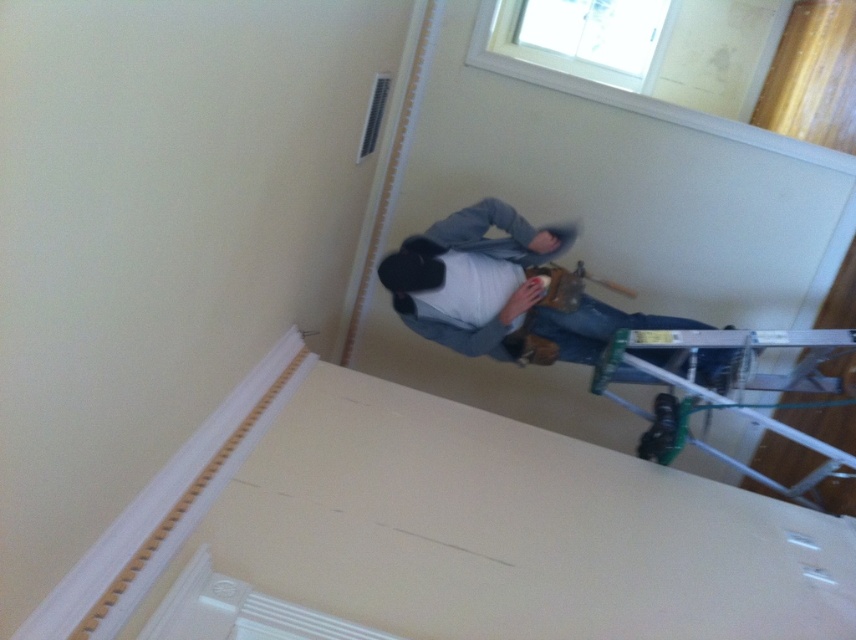
You are a contractor assessing the workspace. You need to move the metallic silver ladder at lower right closer to the window. However, the denim jacket at upper right is in the way. Can you move the ladder around the jacket without moving the jacket itself?

The metallic silver ladder at lower right is behind the denim jacket at upper right. Since the ladder is already positioned behind the jacket, you can move it around to the side of the jacket without needing to move the jacket itself.

You are a painter working in the room and need to place your denim jacket at upper right on the ladder. Can you hang it on the metallic silver ladder at lower right without moving the ladder?

The denim jacket at upper right is positioned on the left side of metallic silver ladder at lower right, so you can hang it on the ladder without moving it since it is already near the ladder.